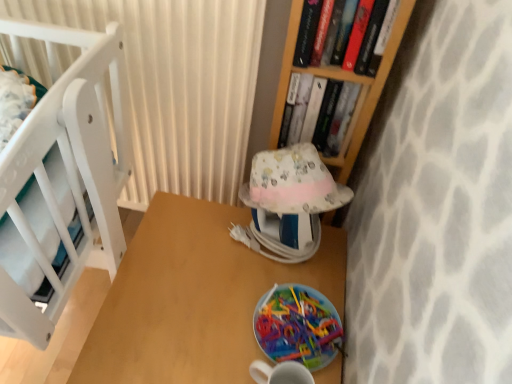
Question: From the image's perspective, would you say hardcover book at upper right, the second book in the back-to-front sequence, is positioned over translucent plastic plate at lower center?

Choices:
 (A) no
 (B) yes

Answer: (B)

Question: Is translucent plastic plate at lower center completely or partially inside hardcover book at upper right, the second book in the back-to-front sequence?

Choices:
 (A) yes
 (B) no

Answer: (B)

Question: Is hardcover book at upper right, which appears as the 1th book when viewed from the front, shorter than translucent plastic plate at lower center?

Choices:
 (A) yes
 (B) no

Answer: (B)

Question: Does hardcover book at upper right, the second book in the back-to-front sequence, have a larger size compared to translucent plastic plate at lower center?

Choices:
 (A) yes
 (B) no

Answer: (A)

Question: Considering the relative sizes of hardcover book at upper right, the second book in the back-to-front sequence, and translucent plastic plate at lower center in the image provided, is hardcover book at upper right, the second book in the back-to-front sequence, wider than translucent plastic plate at lower center?

Choices:
 (A) no
 (B) yes

Answer: (A)

Question: Is hardcover book at upper right, which appears as the 1th book when viewed from the front, spatially inside wooden table at center, or outside of it?

Choices:
 (A) outside
 (B) inside

Answer: (A)

Question: From a real-world perspective, is hardcover book at upper right, the second book in the back-to-front sequence, physically located above or below wooden table at center?

Choices:
 (A) above
 (B) below

Answer: (A)

Question: In terms of size, does hardcover book at upper right, which appears as the 1th book when viewed from the front, appear bigger or smaller than wooden table at center?

Choices:
 (A) big
 (B) small

Answer: (B)

Question: In terms of width, does hardcover book at upper right, the second book in the back-to-front sequence, look wider or thinner when compared to wooden table at center?

Choices:
 (A) wide
 (B) thin

Answer: (B)

Question: In terms of size, does patterned fabric lampshade at center appear bigger or smaller than translucent plastic plate at lower center?

Choices:
 (A) big
 (B) small

Answer: (A)

Question: Would you say patterned fabric lampshade at center is to the left or to the right of translucent plastic plate at lower center in the picture?

Choices:
 (A) left
 (B) right

Answer: (A)

Question: Is patterned fabric lampshade at center wider or thinner than translucent plastic plate at lower center?

Choices:
 (A) wide
 (B) thin

Answer: (A)

Question: From a real-world perspective, is patterned fabric lampshade at center positioned above or below translucent plastic plate at lower center?

Choices:
 (A) above
 (B) below

Answer: (A)

Question: Based on their positions, is hardcover book at upper center, the first book positioned from the back, located to the left or right of hardcover book at upper right, which appears as the 1th book when viewed from the front?

Choices:
 (A) left
 (B) right

Answer: (A)

Question: Considering the positions of hardcover book at upper center, arranged as the 2th book when viewed from the front, and hardcover book at upper right, the second book in the back-to-front sequence, in the image, is hardcover book at upper center, arranged as the 2th book when viewed from the front, bigger or smaller than hardcover book at upper right, the second book in the back-to-front sequence,?

Choices:
 (A) small
 (B) big

Answer: (B)